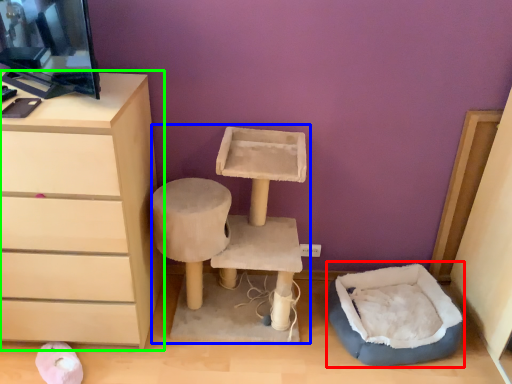
Question: Which object is positioned closest to bean bag chair (highlighted by a red box)? Select from vanity (highlighted by a blue box) and chest of drawers (highlighted by a green box).

Choices:
 (A) vanity
 (B) chest of drawers

Answer: (A)